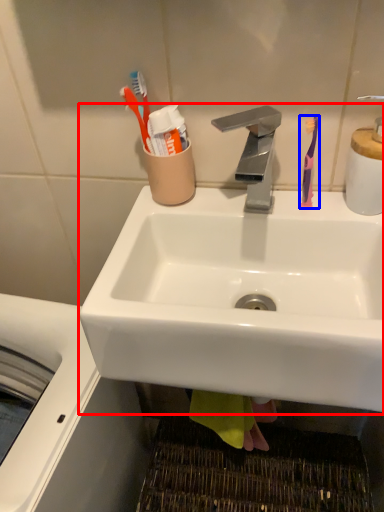
Question: Which of the following is the farthest to the observer, sink (highlighted by a red box) or toothbrush (highlighted by a blue box)?

Choices:
 (A) sink
 (B) toothbrush

Answer: (B)